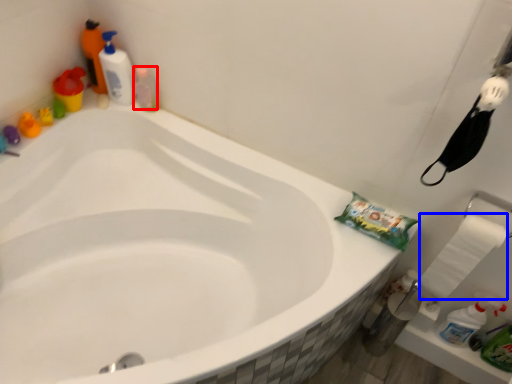
Question: Which of the following is the closest to the observer, cleaning product (highlighted by a red box) or toilet paper (highlighted by a blue box)?

Choices:
 (A) cleaning product
 (B) toilet paper

Answer: (B)